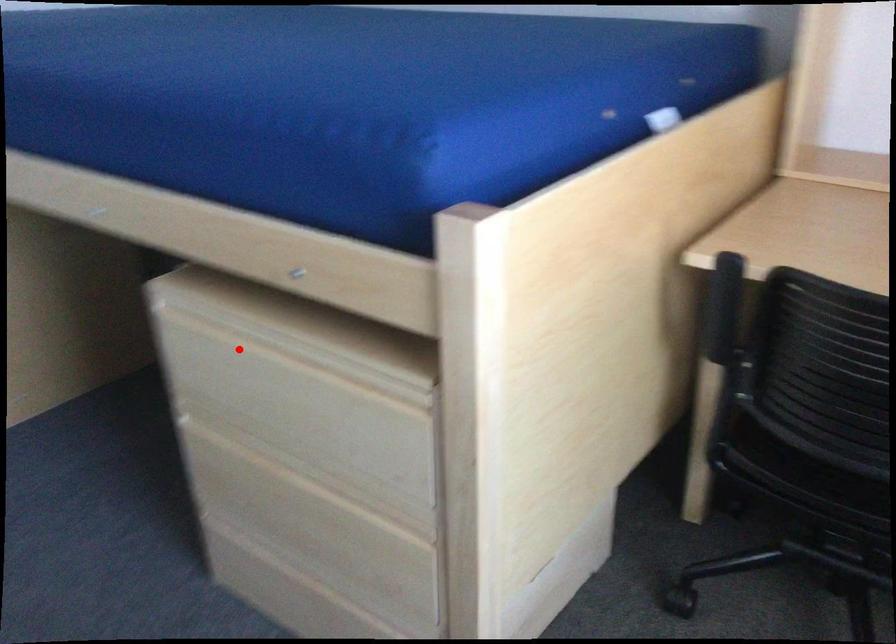
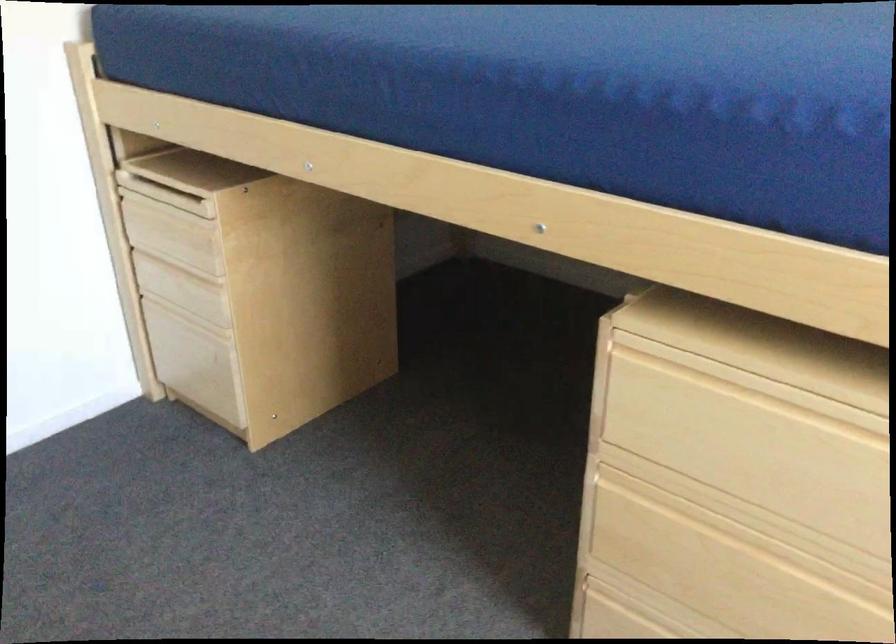
Find the pixel in the second image that matches the highlighted location in the first image.

(743, 406)